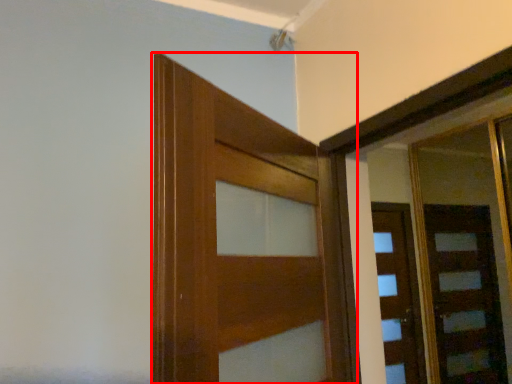
Question: From the image's perspective, what is the correct spatial positioning of door (annotated by the red box) in reference to door?

Choices:
 (A) above
 (B) below

Answer: (A)